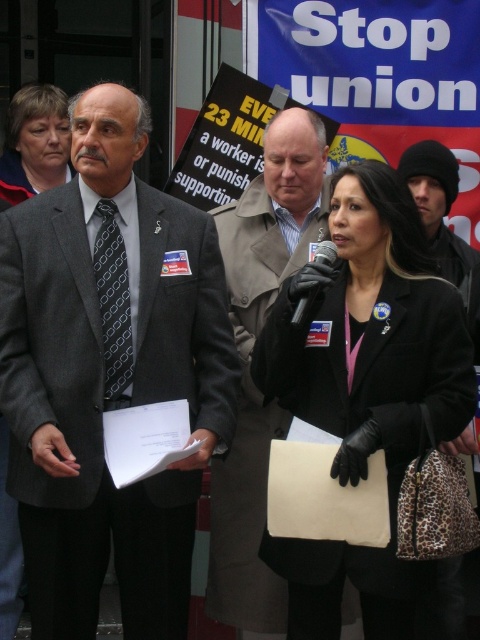
Is gray textured suit at center positioned at the back of matte black jacket at upper left?

That is False.

Which of these two, gray textured suit at center or matte black jacket at upper left, stands taller?

gray textured suit at center

Does point (67, 289) come behind point (62, 170)?

That is False.

Find the location of a particular element. gray textured suit at center is located at coordinates (108, 374).

Is gray textured suit at center wider than matte gray coat at upper left?

Correct, the width of gray textured suit at center exceeds that of matte gray coat at upper left.

Who is lower down, gray textured suit at center or matte gray coat at upper left?

gray textured suit at center is below.

Locate an element on the screen. gray textured suit at center is located at coordinates (108, 374).

Where is `gray textured suit at center`? This screenshot has width=480, height=640. gray textured suit at center is located at coordinates (108, 374).

Can you confirm if gray textured suit at center is positioned to the right of light brown leather coat at center?

No, gray textured suit at center is not to the right of light brown leather coat at center.

Which is in front, point (35, 621) or point (352, 620)?

Positioned in front is point (35, 621).

Who is more forward, (x=91, y=170) or (x=276, y=426)?

Point (x=91, y=170) is more forward.

This screenshot has height=640, width=480. Identify the location of gray textured suit at center. (108, 374).